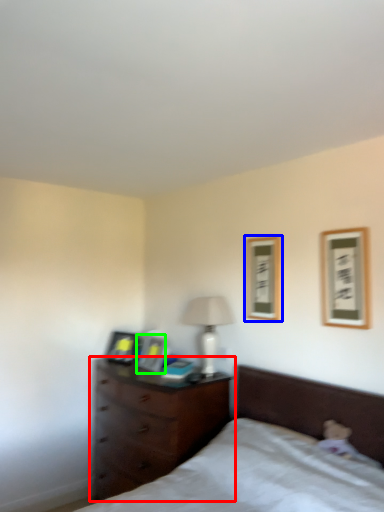
Question: Which object is the closest to the chest of drawers (highlighted by a red box)? Choose among these: picture frame (highlighted by a blue box) or picture frame (highlighted by a green box).

Choices:
 (A) picture frame
 (B) picture frame

Answer: (B)